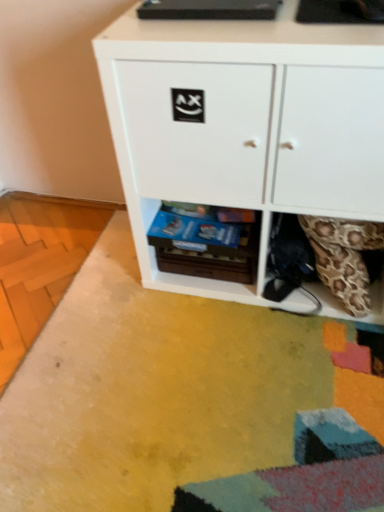
I want to click on vacant region to the left of wooden drawer at lower center, so click(x=125, y=290).